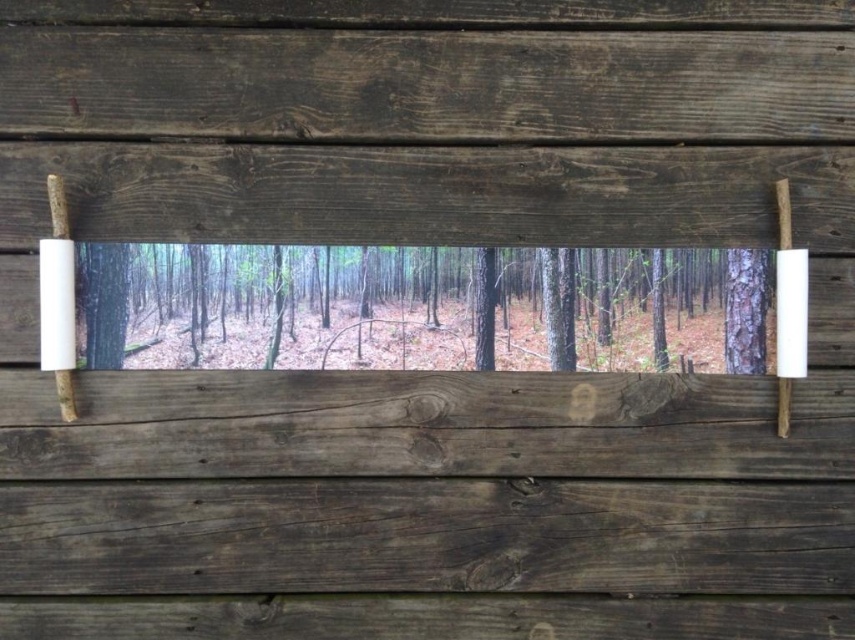
Who is lower down, green matte tree at center or smooth brown tree trunk at right?

smooth brown tree trunk at right is below.

Does green matte tree at center have a larger size compared to smooth brown tree trunk at right?

Yes, green matte tree at center is bigger than smooth brown tree trunk at right.

Where is `green matte tree at center`? The width and height of the screenshot is (855, 640). green matte tree at center is located at coordinates (417, 310).

In order to click on green matte tree at center in this screenshot , I will do `click(417, 310)`.

Does dark brown wood at center appear under smooth brown tree trunk at right?

Incorrect, dark brown wood at center is not positioned below smooth brown tree trunk at right.

Describe the element at coordinates (428, 84) in the screenshot. I see `dark brown wood at center` at that location.

Is point (93, 115) in front of point (747, 365)?

That is True.

Locate an element on the screen. Image resolution: width=855 pixels, height=640 pixels. dark brown wood at center is located at coordinates (428, 84).

Between dark wood plank at center and smooth brown tree trunk at right, which one has more height?

smooth brown tree trunk at right

Which of these two, dark wood plank at center or smooth brown tree trunk at right, stands shorter?

Standing shorter between the two is dark wood plank at center.

Where is `dark wood plank at center`? dark wood plank at center is located at coordinates (425, 536).

The height and width of the screenshot is (640, 855). I want to click on dark wood plank at center, so click(x=425, y=536).